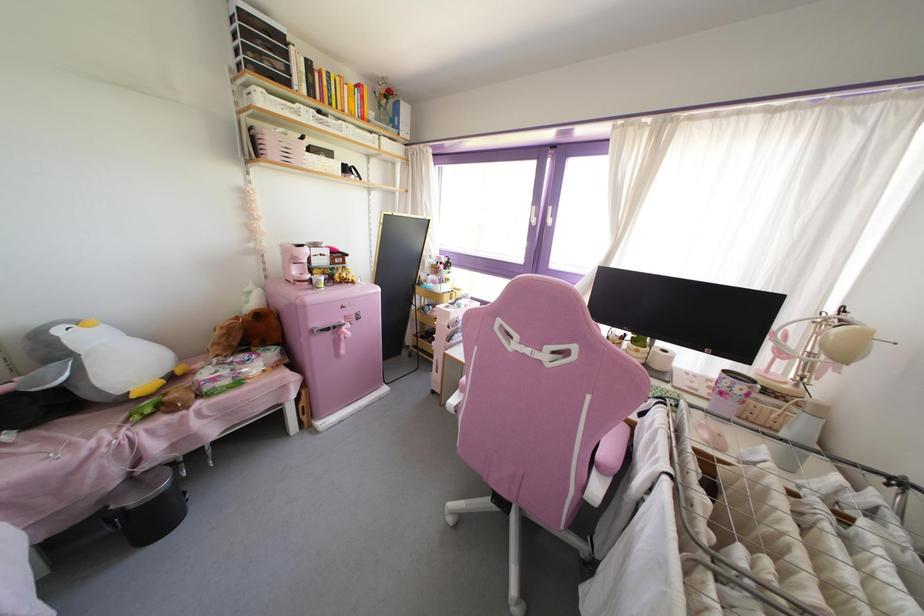
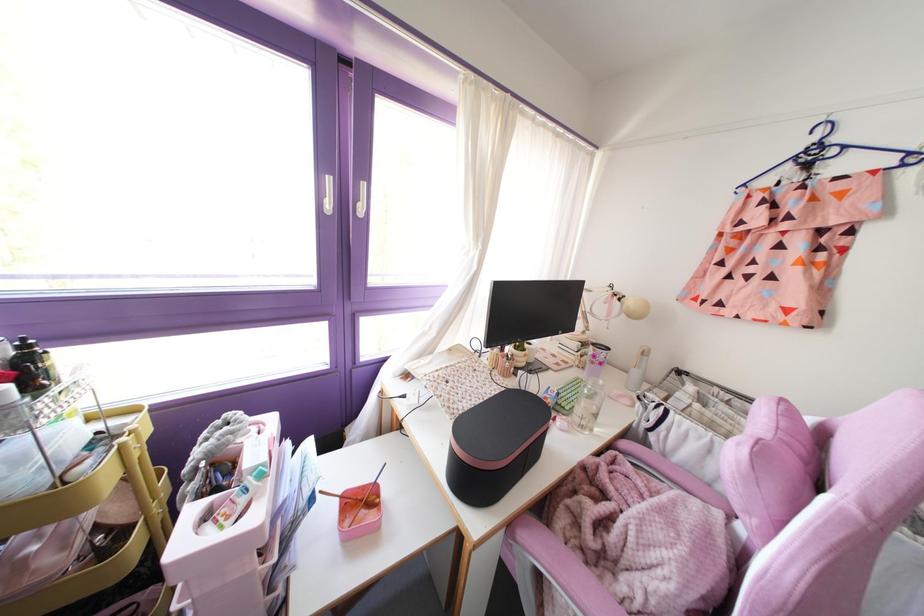
Find the pixel in the second image that matches point (444, 268) in the first image.

(32, 389)